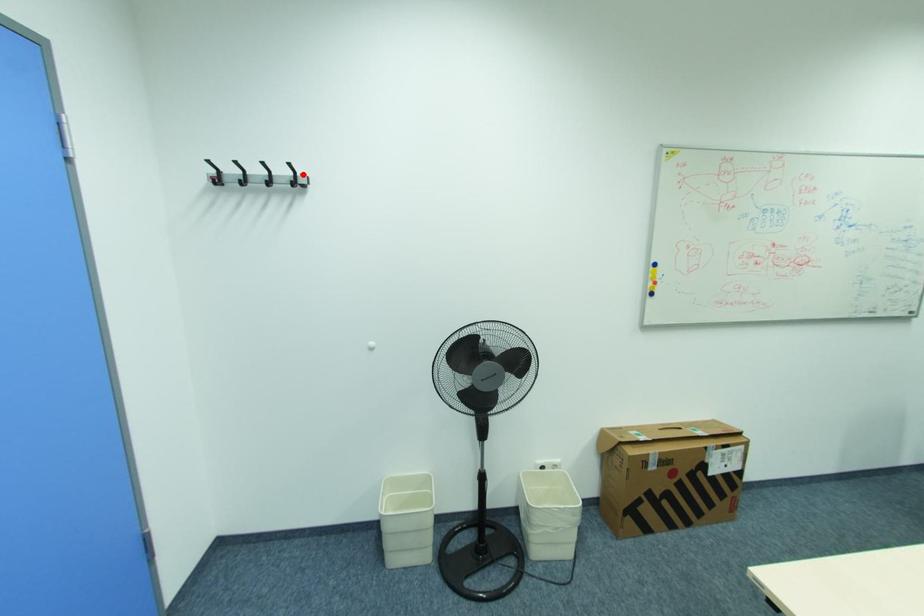
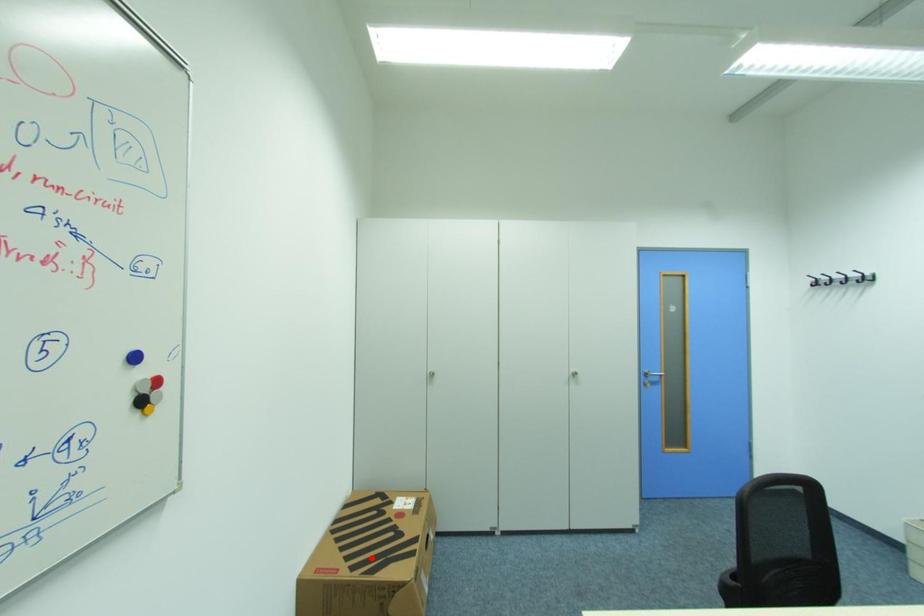
I am providing you with two images of the same scene from different viewpoints. A red point is marked on the first image and another point is marked on the second image. Is the marked point in image1 the same physical position as the marked point in image2?

No